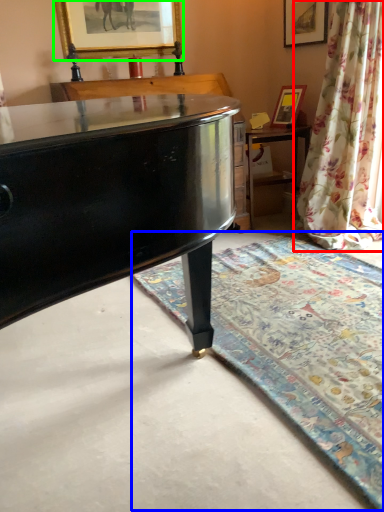
Question: Based on their relative distances, which object is farther from curtain (highlighted by a red box)? Choose from mat (highlighted by a blue box) and picture frame (highlighted by a green box).

Choices:
 (A) mat
 (B) picture frame

Answer: (B)